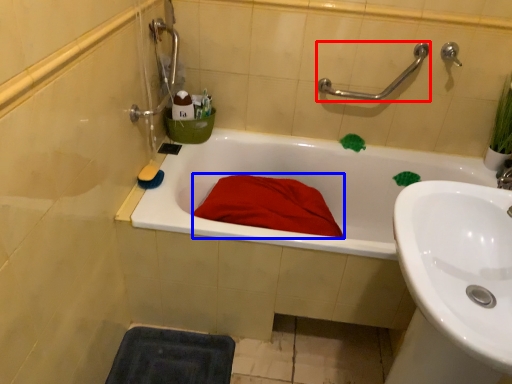
Question: Among these objects, which one is nearest to the camera, shower (highlighted by a red box) or blanket (highlighted by a blue box)?

Choices:
 (A) shower
 (B) blanket

Answer: (B)